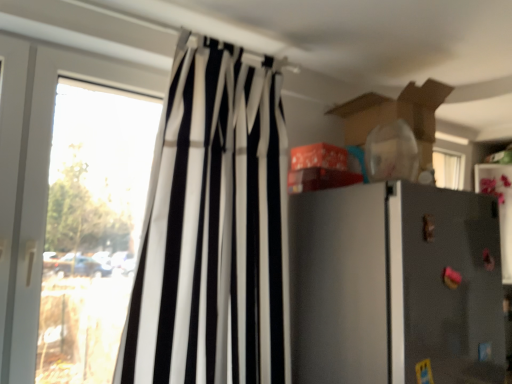
The width and height of the screenshot is (512, 384). What do you see at coordinates (92, 226) in the screenshot? I see `transparent glass window at left` at bounding box center [92, 226].

Where is `black/white striped curtain at left`? The height and width of the screenshot is (384, 512). black/white striped curtain at left is located at coordinates (213, 230).

This screenshot has height=384, width=512. What do you see at coordinates (213, 230) in the screenshot?
I see `black/white striped curtain at left` at bounding box center [213, 230].

Locate an element on the screen. transparent glass window at left is located at coordinates (92, 226).

Based on their positions, is black/white striped curtain at left located to the left or right of metallic gray refrigerator at right?

Based on their positions, black/white striped curtain at left is located to the left of metallic gray refrigerator at right.

From a real-world perspective, is black/white striped curtain at left positioned above or below metallic gray refrigerator at right?

black/white striped curtain at left is above metallic gray refrigerator at right.

Considering the sizes of objects black/white striped curtain at left and metallic gray refrigerator at right in the image provided, who is shorter, black/white striped curtain at left or metallic gray refrigerator at right?

metallic gray refrigerator at right.

Looking at the image, does black/white striped curtain at left seem bigger or smaller compared to metallic gray refrigerator at right?

Clearly, black/white striped curtain at left is smaller in size than metallic gray refrigerator at right.

Consider the image. Which object is closer to the camera taking this photo, black/white striped curtain at left or transparent glass window at left?

Positioned in front is black/white striped curtain at left.

Is black/white striped curtain at left wider or thinner than transparent glass window at left?

In the image, black/white striped curtain at left appears to be wider than transparent glass window at left.

Which of these two, black/white striped curtain at left or transparent glass window at left, stands shorter?

Standing shorter between the two is transparent glass window at left.

How many degrees apart are the facing directions of black/white striped curtain at left and transparent glass window at left?

0.000103 degrees separate the facing orientations of black/white striped curtain at left and transparent glass window at left.

Is transparent glass window at left completely or partially inside metallic gray refrigerator at right?

No, transparent glass window at left is located outside of metallic gray refrigerator at right.

From a real-world perspective, which is physically below, metallic gray refrigerator at right or transparent glass window at left?

metallic gray refrigerator at right, from a real-world perspective.

Does point (475, 303) lie in front of point (129, 159)?

Yes, it is in front of point (129, 159).

Is metallic gray refrigerator at right aimed at transparent glass window at left?

No, metallic gray refrigerator at right is not aimed at transparent glass window at left.

From the image's perspective, which is above, metallic gray refrigerator at right or black/white striped curtain at left?

black/white striped curtain at left appears higher in the image.

From a real-world perspective, relative to black/white striped curtain at left, is metallic gray refrigerator at right vertically above or below?

Clearly, from a real-world perspective, metallic gray refrigerator at right is below black/white striped curtain at left.

From a real-world perspective, is transparent glass window at left physically located above or below metallic gray refrigerator at right?

From a real-world perspective, transparent glass window at left is physically above metallic gray refrigerator at right.

From the image's perspective, is transparent glass window at left located above metallic gray refrigerator at right?

Correct, transparent glass window at left appears higher than metallic gray refrigerator at right in the image.

In the image, is transparent glass window at left positioned in front of or behind metallic gray refrigerator at right?

Clearly, transparent glass window at left is behind metallic gray refrigerator at right.

Is transparent glass window at left looking in the opposite direction of metallic gray refrigerator at right?

That's not correct — transparent glass window at left is not looking away from metallic gray refrigerator at right.

Considering the relative sizes of transparent glass window at left and black/white striped curtain at left in the image provided, is transparent glass window at left thinner than black/white striped curtain at left?

Yes, transparent glass window at left is thinner than black/white striped curtain at left.

Between transparent glass window at left and black/white striped curtain at left, which one is positioned behind?

transparent glass window at left is more distant.

Which object is positioned more to the left, transparent glass window at left or black/white striped curtain at left?

Positioned to the left is transparent glass window at left.

How different are the orientations of transparent glass window at left and black/white striped curtain at left in degrees?

The angular difference between transparent glass window at left and black/white striped curtain at left is 0.000103 degrees.

In order to click on refrigerator behind the black/white striped curtain at left in this screenshot , I will do `click(395, 286)`.

You are a GUI agent. You are given a task and a screenshot of the screen. Output one action in this format:
    pyautogui.click(x=<x>, y=<y>)
    Task: Click on the window that appears on the left of black/white striped curtain at left
    
    Given the screenshot: What is the action you would take?
    pyautogui.click(x=92, y=226)

Estimate the real-world distances between objects in this image. Which object is further from metallic gray refrigerator at right, black/white striped curtain at left or transparent glass window at left?

The object further to metallic gray refrigerator at right is transparent glass window at left.

Based on their spatial positions, is metallic gray refrigerator at right or black/white striped curtain at left closer to transparent glass window at left?

The object closer to transparent glass window at left is black/white striped curtain at left.

Considering their positions, is metallic gray refrigerator at right positioned closer to black/white striped curtain at left than transparent glass window at left?

transparent glass window at left is positioned closer to the anchor black/white striped curtain at left.

In the scene shown: Considering their positions, is transparent glass window at left positioned closer to metallic gray refrigerator at right than black/white striped curtain at left?

The object closer to metallic gray refrigerator at right is black/white striped curtain at left.

Estimate the real-world distances between objects in this image. Which object is closer to transparent glass window at left, black/white striped curtain at left or metallic gray refrigerator at right?

Based on the image, black/white striped curtain at left appears to be nearer to transparent glass window at left.

From the image, which object appears to be farther from black/white striped curtain at left, transparent glass window at left or metallic gray refrigerator at right?

Among the two, metallic gray refrigerator at right is located further to black/white striped curtain at left.

Identify the location of curtain situated between transparent glass window at left and metallic gray refrigerator at right from left to right. (213, 230).